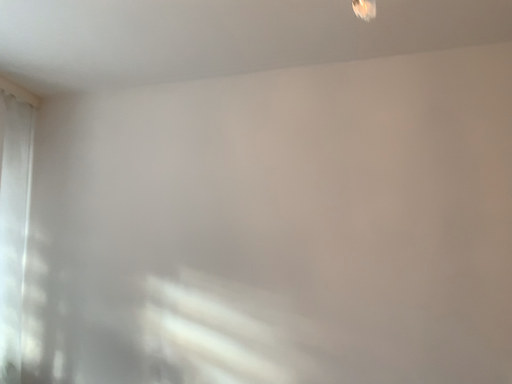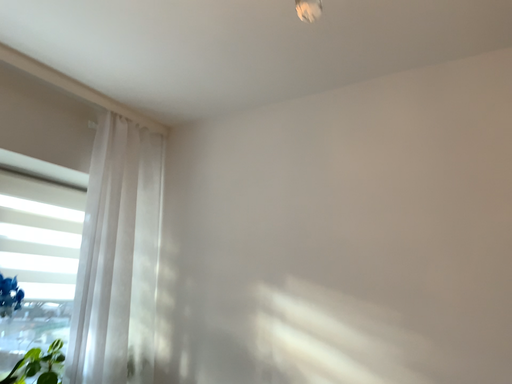
Question: How did the camera likely rotate when shooting the video?

Choices:
 (A) rotated left
 (B) rotated right

Answer: (A)